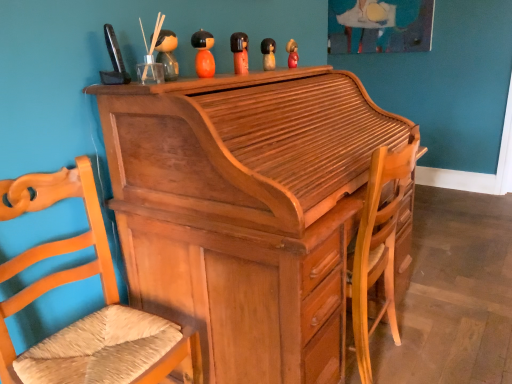
Question: Based on their sizes in the image, would you say light brown wood desk at center is bigger or smaller than wooden woven seat at left?

Choices:
 (A) small
 (B) big

Answer: (B)

Question: In terms of height, does light brown wood desk at center look taller or shorter compared to wooden woven seat at left?

Choices:
 (A) short
 (B) tall

Answer: (B)

Question: Which object is the closest to the matte wooden figurine at upper center, arranged as the fifth toy when viewed from the front?

Choices:
 (A) light brown wood desk at center
 (B) matte yellow doll at center, the fourth toy viewed from the left
 (C) orange matte wooden doll at upper center, positioned as the fourth toy in right-to-left order
 (D) matte wooden figurine at upper center, arranged as the 1th toy when viewed from the left
 (E) wooden woven seat at left

Answer: (B)

Question: Based on their relative distances, which object is farther from the orange matte wooden doll at upper center, the 2th toy when ordered from left to right?

Choices:
 (A) wooden woven seat at left
 (B) matte orange doll at upper center, positioned as the third toy in left-to-right order
 (C) matte wooden figurine at upper center, which appears as the 5th toy when viewed from the back
 (D) light brown wood desk at center
 (E) matte wooden figurine at upper center, the 5th toy from the left

Answer: (A)